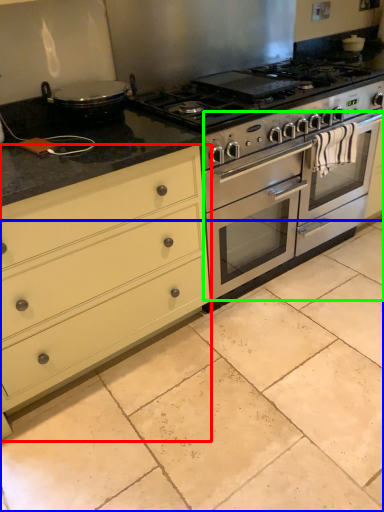
Question: Estimate the real-world distances between objects in this image. Which object is closer to chest of drawers (highlighted by a red box), ceramic tile (highlighted by a blue box) or oven (highlighted by a green box)?

Choices:
 (A) ceramic tile
 (B) oven

Answer: (A)